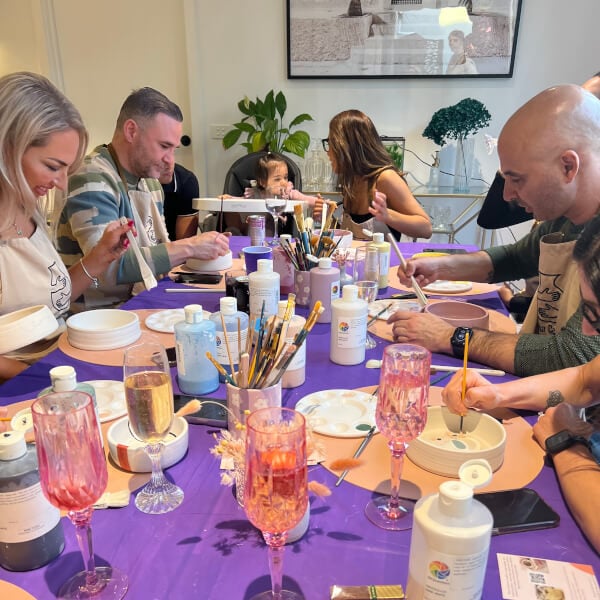
This screenshot has width=600, height=600. I want to click on plant, so click(x=453, y=115), click(x=273, y=130).